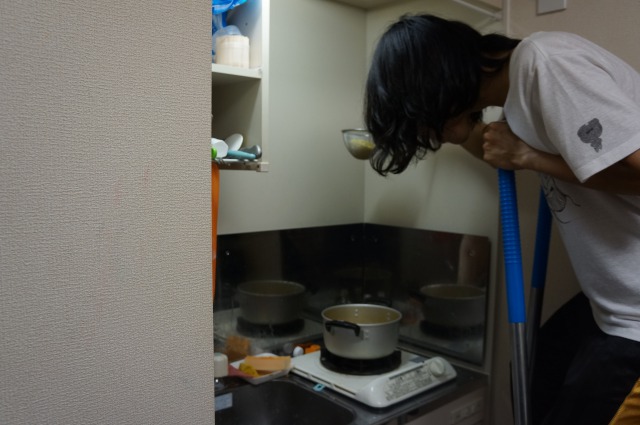
I want to click on pot, so click(x=384, y=333).